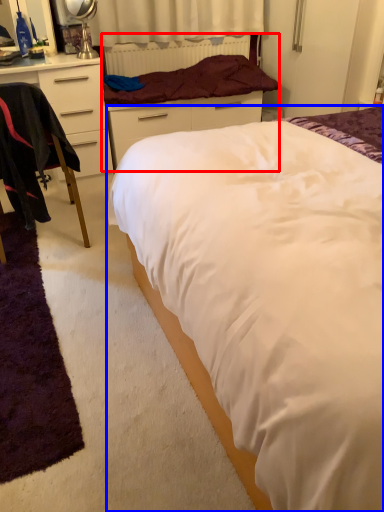
Question: Which object appears closest to the camera in this image, bed frame (highlighted by a red box) or bed (highlighted by a blue box)?

Choices:
 (A) bed frame
 (B) bed

Answer: (B)